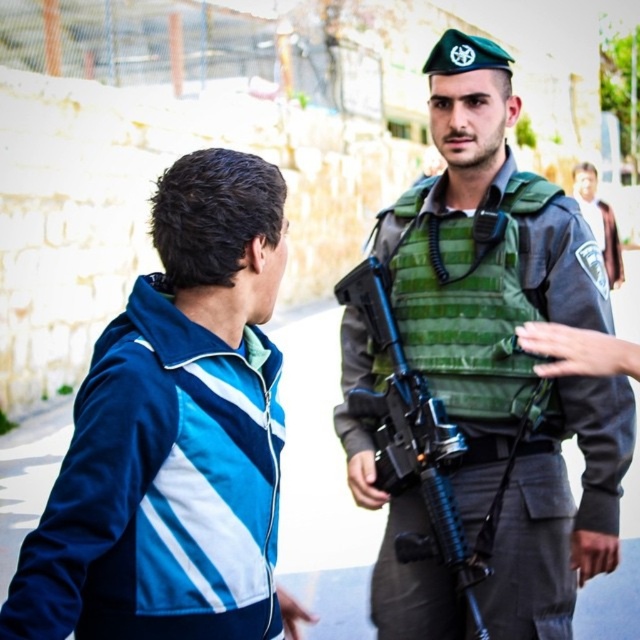
Is blue fabric jacket at upper left thinner than green uniform at center?

Correct, blue fabric jacket at upper left's width is less than green uniform at center's.

Image resolution: width=640 pixels, height=640 pixels. What do you see at coordinates (173, 435) in the screenshot?
I see `blue fabric jacket at upper left` at bounding box center [173, 435].

Where is `blue fabric jacket at upper left`? The width and height of the screenshot is (640, 640). blue fabric jacket at upper left is located at coordinates (173, 435).

Between matte black rifle at center and green uniform at center, which one appears on the left side from the viewer's perspective?

Positioned to the left is matte black rifle at center.

Can you confirm if matte black rifle at center is wider than green uniform at center?

No.

Who is more forward, (x=449, y=568) or (x=579, y=204)?

Point (x=449, y=568)

The height and width of the screenshot is (640, 640). Identify the location of matte black rifle at center. coord(416,444).

Consider the image. Does blue fabric jacket at upper left appear on the left side of matte black rifle at center?

Indeed, blue fabric jacket at upper left is positioned on the left side of matte black rifle at center.

Identify the location of blue fabric jacket at upper left. (173, 435).